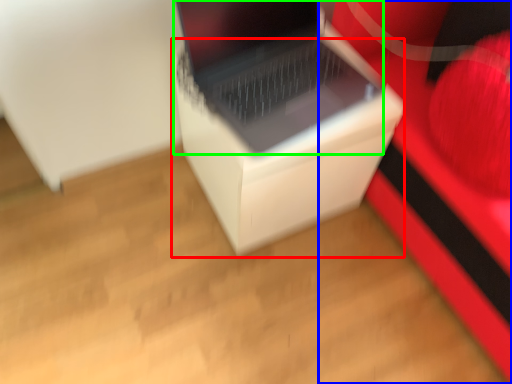
Question: Based on their relative distances, which object is nearer to cardboard box (highlighted by a red box)? Choose from furniture (highlighted by a blue box) and laptop (highlighted by a green box).

Choices:
 (A) furniture
 (B) laptop

Answer: (B)